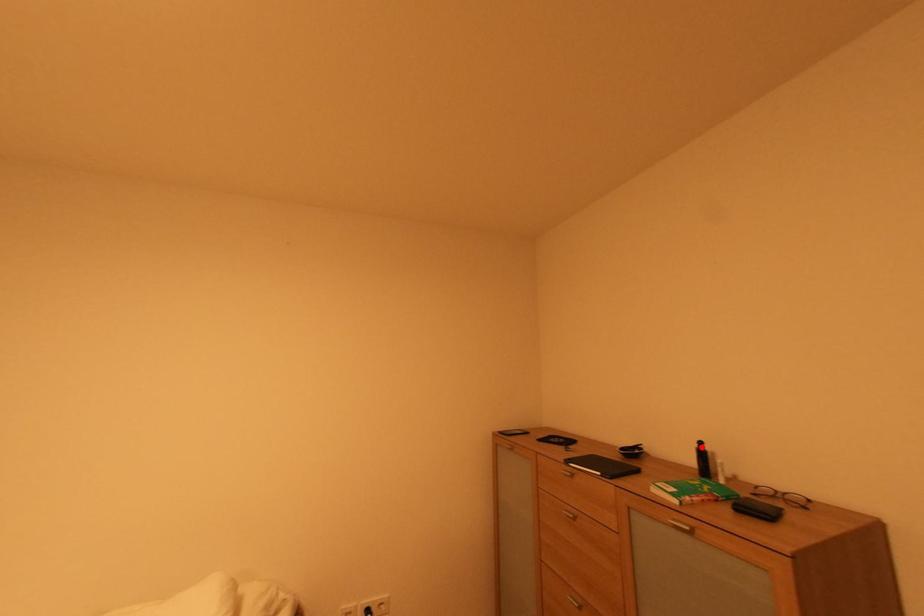
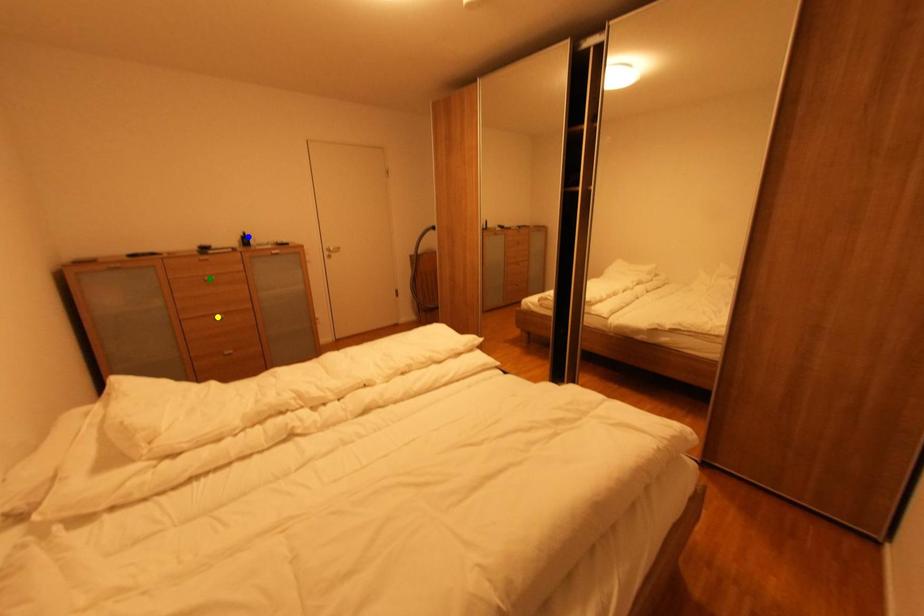
Question: I am providing you with two images of the same scene from different viewpoints. A red point is marked on the first image. You are given multiple points on the second image. Which point in image 2 is actually the same real-world point as the red point in image 1?

Choices:
 (A) green point
 (B) yellow point
 (C) blue point

Answer: (C)